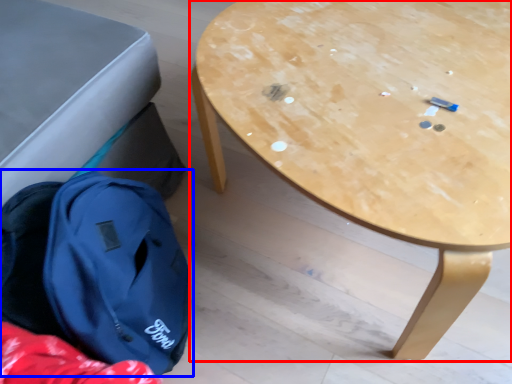
Question: Among these objects, which one is farthest to the camera, table (highlighted by a red box) or backpack (highlighted by a blue box)?

Choices:
 (A) table
 (B) backpack

Answer: (B)